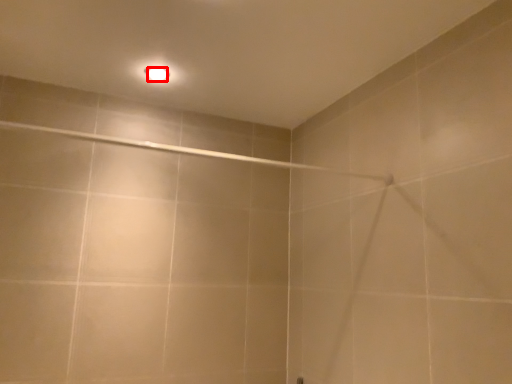
Question: From the image's perspective, where is light bulb (annotated by the red box) located in relation to shower in the image?

Choices:
 (A) below
 (B) above

Answer: (B)